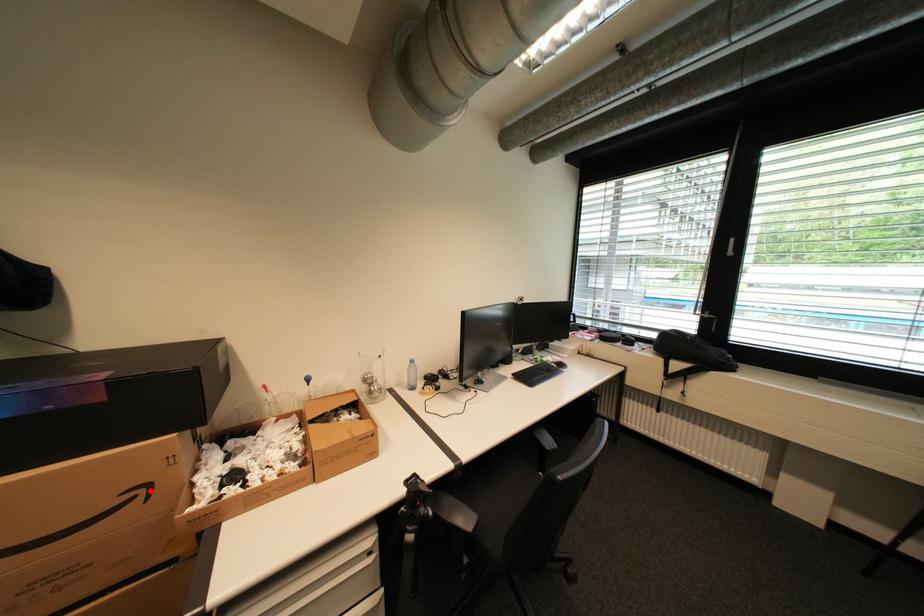
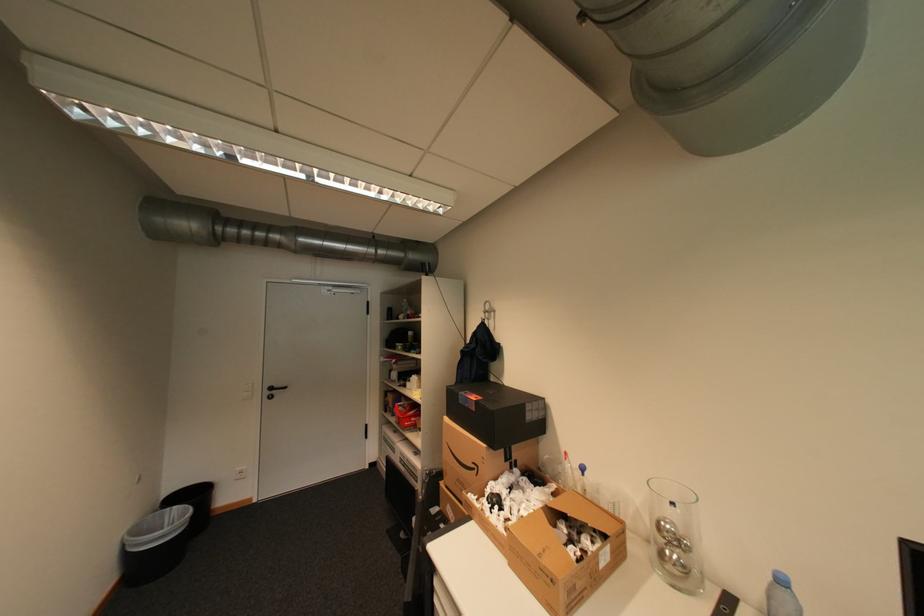
Question: I am providing you with two images of the same scene from different viewpoints. Given a red point in image1, look at the same physical point in image2. Is it:

Choices:
 (A) Closer to the viewpoint
 (B) Farther from the viewpoint

Answer: (B)